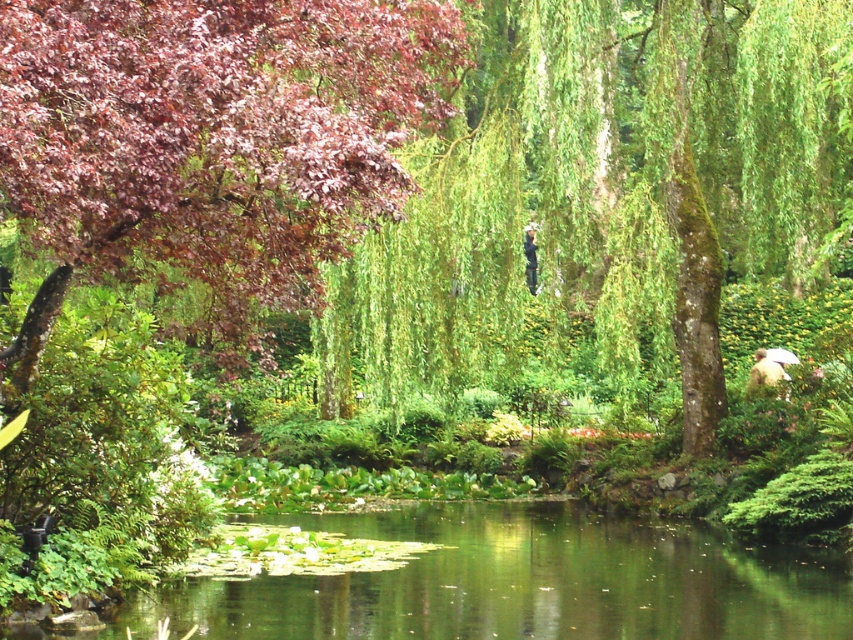
You are a photographer planning to capture the entire scene of the garden. You notice the green liquid water at center and the camouflage jacket at lower right. Which object should you focus on to ensure both are visible in the frame without needing to zoom in or out?

The green liquid water at center is bigger than the camouflage jacket at lower right, so focusing on the green liquid water at center would allow both objects to fit within the frame without adjusting the zoom.

You are a gardener who wants to place a 5 meter long wooden bench between the green liquid water at center and the dark blue fabric at center. Can you fit the bench between them without overlapping either object?

The distance between the green liquid water at center and the dark blue fabric at center is 6.10 meters. Since the bench is 5 meters long, there is enough space to fit it between them without overlapping either object.

You are planning to place a small decorative boat in the garden. The boat requires a water surface wider than the camouflage jacket at lower right to navigate smoothly. Is the green liquid water at center suitable for this purpose?

The green liquid water at center has a width larger than the camouflage jacket at lower right, so it is suitable for placing the small decorative boat as it provides enough space for smooth navigation.